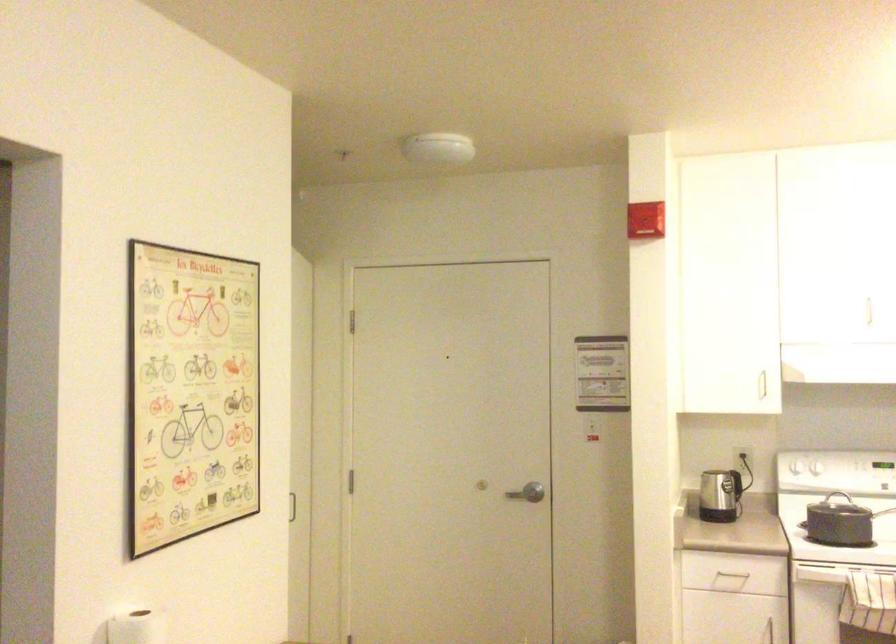
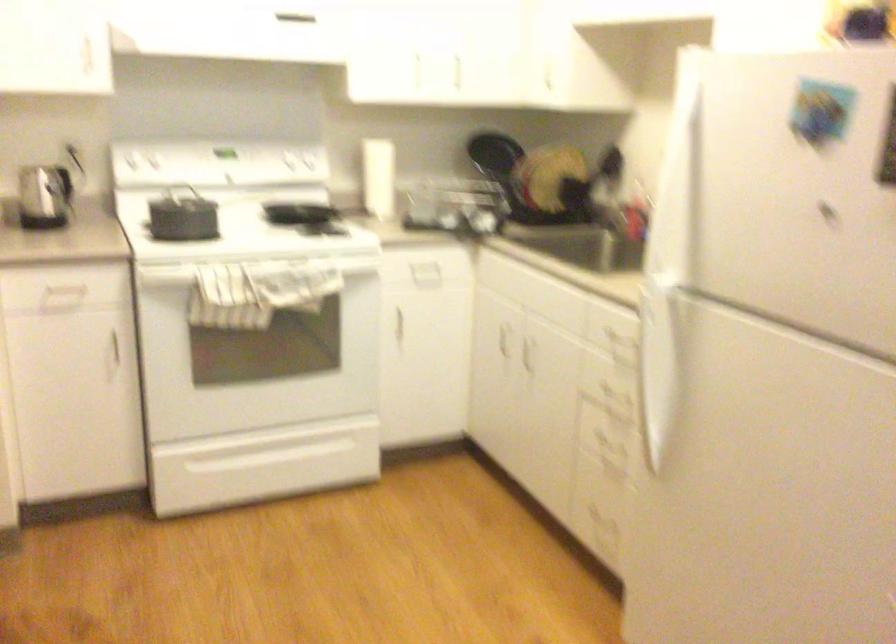
In the second image, find the point that corresponds to the point at 802,524 in the first image.

(141, 225)